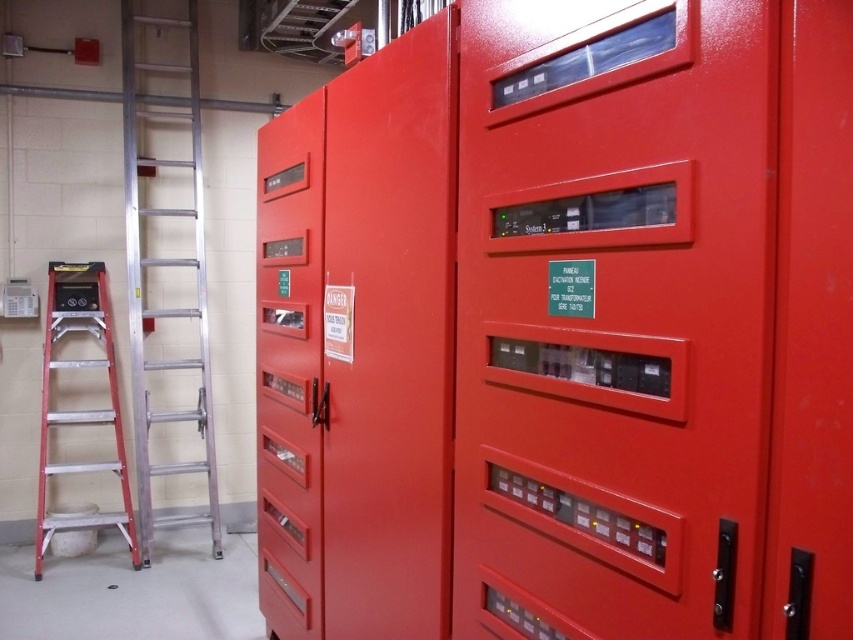
You are a maintenance worker in an industrial room. You need to reach a high electrical cabinet. You see a red aluminum ladder at left and a metallic silver screwdriver at center. Which tool can you use to climb up to the electrical cabinet?

The red aluminum ladder at left is larger and suitable for climbing, so you can use the red aluminum ladder at left to reach the electrical cabinet.

You need to store a large tool box that requires a space bigger than the aluminum ladder at left. Is the glossy red locker at center suitable for this?

The glossy red locker at center has a larger size compared to the aluminum ladder at left, so it can accommodate the large tool box that requires more space than the aluminum ladder at left.